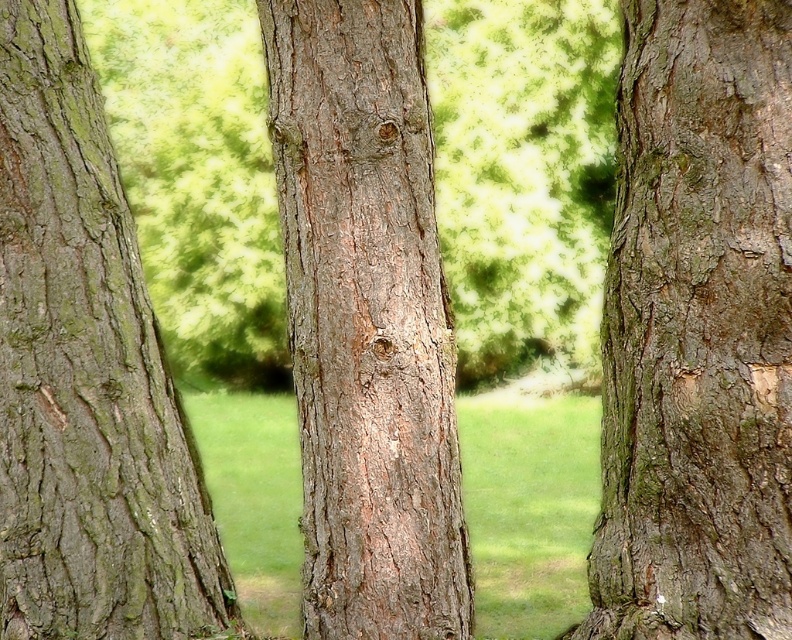
Consider the image. Who is positioned more to the left, green rough bark tree at right or smooth brown bark at center?

smooth brown bark at center

Between point (775, 440) and point (391, 145), which one is positioned behind?

Point (391, 145)

Where is `green rough bark tree at right`? The width and height of the screenshot is (792, 640). green rough bark tree at right is located at coordinates (697, 330).

Is green rough bark tree at right smaller than green rough bark at center?

Yes.

Find the location of a particular element. green rough bark tree at right is located at coordinates (697, 330).

Locate an element on the screen. green rough bark tree at right is located at coordinates (697, 330).

Looking at this image, between smooth brown bark at center and green rough bark at center, which one appears on the right side from the viewer's perspective?

smooth brown bark at center is more to the right.

Does smooth brown bark at center lie behind green rough bark at center?

No, it is in front of green rough bark at center.

Locate an element on the screen. The image size is (792, 640). smooth brown bark at center is located at coordinates (366, 321).

In order to click on smooth brown bark at center in this screenshot , I will do `click(366, 321)`.